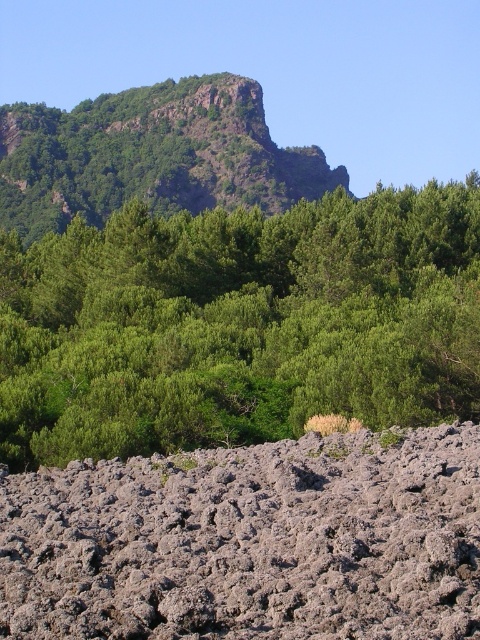
You are a hiker standing at the edge of the rugged, rocky terrain in the foreground of the image. You notice the gray rough rock at lower center. Based on its 2D coordinates, can you determine if it is closer to the left or right side of the image?

Answer: The gray rough rock at lower center is located at point 0.847 on the x axis, which means it is closer to the right side of the image.

You are a hiker standing at the base of the rugged rock mountain at upper center. You notice a green leafy tree at upper center nearby. Which one is closer to you in terms of size?

The green leafy tree at upper center is smaller than the rugged rock mountain at upper center, so the tree is closer to your size.